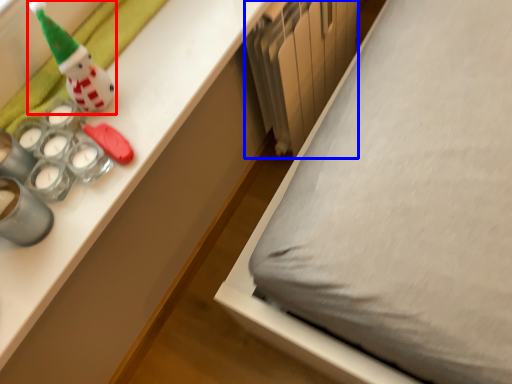
Question: Which object is further to the camera taking this photo, toy (highlighted by a red box) or radiator (highlighted by a blue box)?

Choices:
 (A) toy
 (B) radiator

Answer: (B)